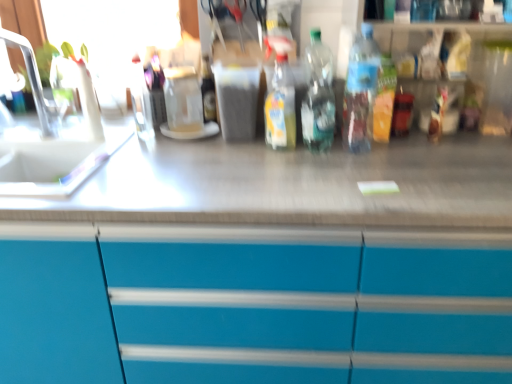
Find the location of a particular element. The image size is (512, 384). vacant region to the left of translucent plastic bottle at center, which ranks as the fourth bottle in left-to-right order is located at coordinates (x=291, y=157).